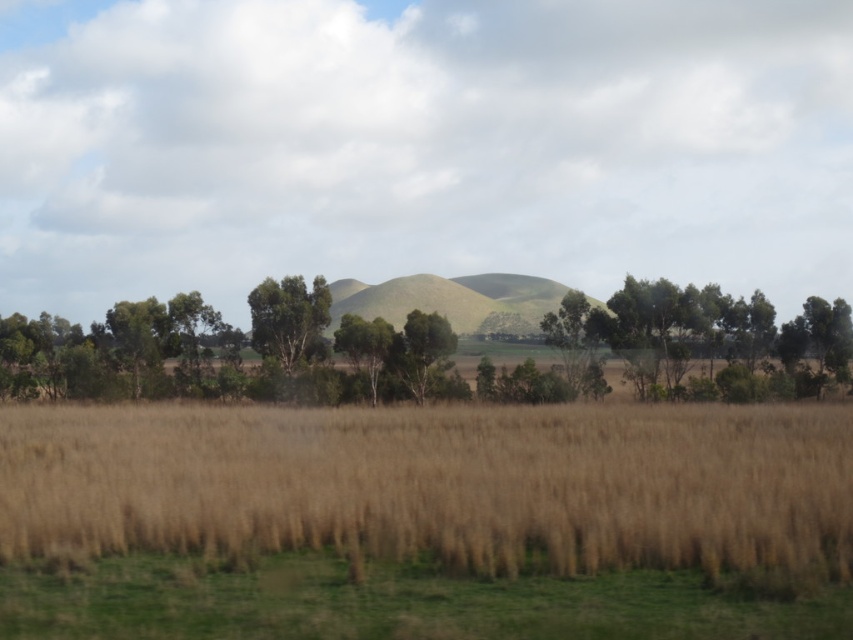
Question: Which of these objects is positioned closest to the brown dry grass at lower center?

Choices:
 (A) green leafy tree at center
 (B) green grassy hill at center

Answer: (A)

Question: Which of these objects is positioned closest to the brown dry grass at lower center?

Choices:
 (A) green leafy tree at center
 (B) green grassy hill at center
 (C) brown grassy field at center

Answer: (C)

Question: Can you confirm if brown grassy field at center is positioned above brown dry grass at lower center?

Choices:
 (A) yes
 (B) no

Answer: (B)

Question: Is brown dry grass at lower center smaller than green grassy hill at center?

Choices:
 (A) yes
 (B) no

Answer: (A)

Question: Can you confirm if brown dry grass at lower center is thinner than green leafy tree at center?

Choices:
 (A) no
 (B) yes

Answer: (A)

Question: Which of the following is the closest to the observer?

Choices:
 (A) (254, 307)
 (B) (691, 429)
 (C) (672, 611)

Answer: (C)